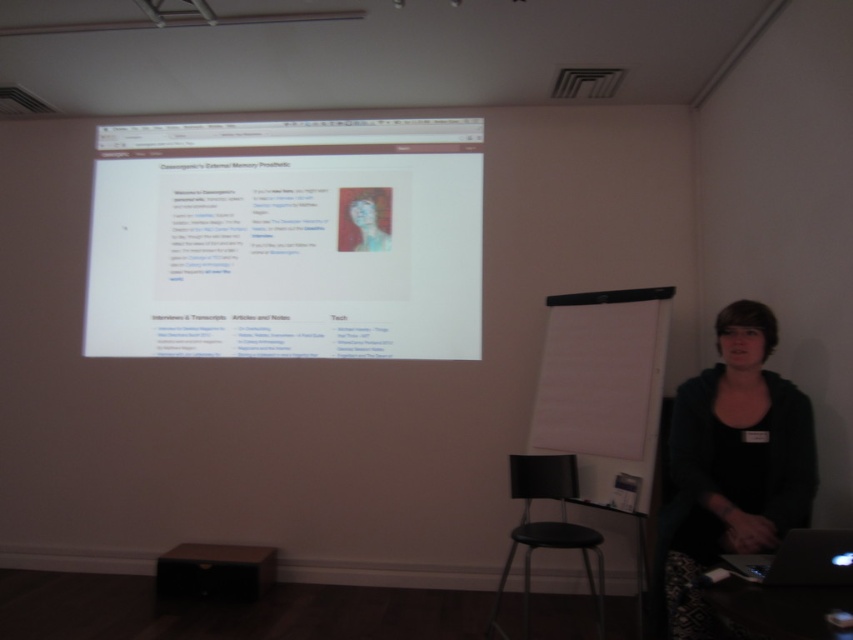
You are attending a presentation and need to place a notebook between the brown matte stool at lower center and the black glossy laptop at lower right. Can the notebook fit horizontally between them?

The brown matte stool at lower center is wider than the black glossy laptop at lower right. Since the stool is wider, there might be enough space horizontally between them to place the notebook, but this depends on the exact dimensions of the notebook and the distance between the two objects.

You are an attendee at the presentation and want to sit down. There is a black fabric at lower right and a black plastic stool at lower center. Which object should you sit on?

You should sit on the black plastic stool at lower center because it is a stool designed for sitting, while the black fabric at lower right is likely a decorative or non seating item.

You are an attendee at the presentation and need to place a 10cm tall notebook on the black glossy laptop at lower right and the black plastic stool at lower center. Which surface can the notebook fit on without exceeding the height of the object?

The black glossy laptop at lower right has a lesser height compared to black plastic stool at lower center. Since the notebook is 10cm tall, it can be placed on the black plastic stool at lower center as it has a greater height, but it may not fit on the laptop due to its shorter height.